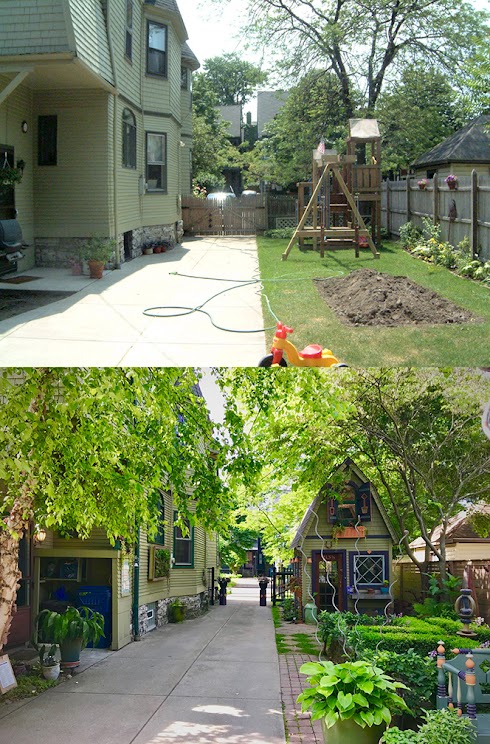
This screenshot has width=490, height=744. I want to click on plant, so click(347, 698).